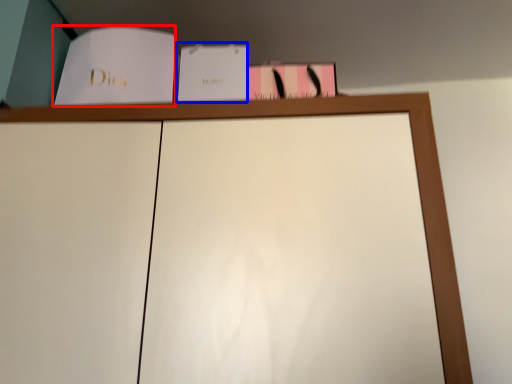
Question: Which of the following is the closest to the observer, paperback book (highlighted by a red box) or paperback book (highlighted by a blue box)?

Choices:
 (A) paperback book
 (B) paperback book

Answer: (A)